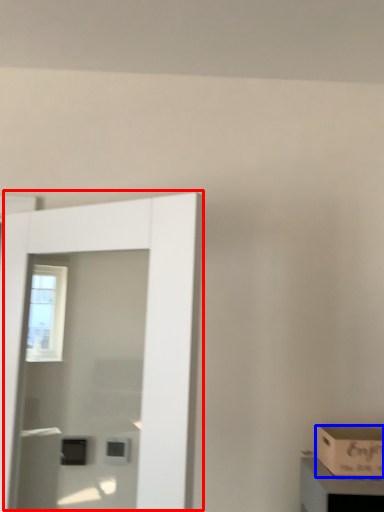
Question: Which object appears farthest to the camera in this image, door (highlighted by a red box) or box (highlighted by a blue box)?

Choices:
 (A) door
 (B) box

Answer: (B)